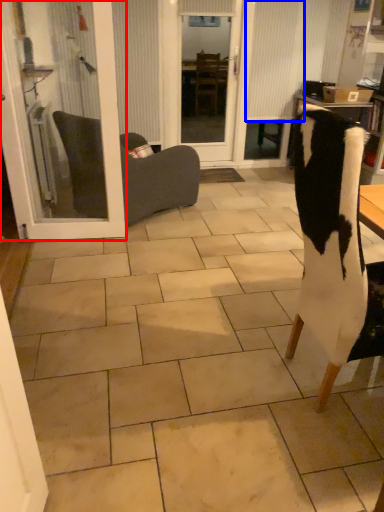
Question: Which of the following is the closest to the observer, door (highlighted by a red box) or curtain (highlighted by a blue box)?

Choices:
 (A) door
 (B) curtain

Answer: (A)